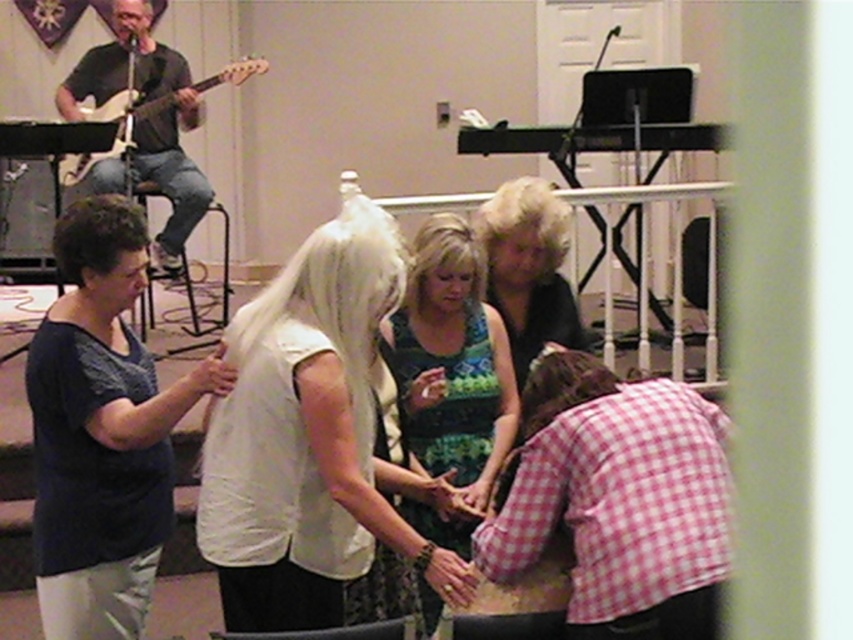
You are a photographer at the event and need to capture a photo of the white matte veil at center and the dark blue fabric shirt at left. Based on their heights, which object should you adjust your camera angle to focus on first?

The white matte veil at center is not as tall as the dark blue fabric shirt at left, so you should focus on the dark blue fabric shirt at left first since it is taller and might be more prominent in the frame.

You are a photographer at a wedding event. You want to capture a photo of the white matte veil at center and the dark blue fabric shirt at left in the same frame. The camera you are using has a minimum focus distance of 30 centimeters. Can you take the photo without moving either object?

The white matte veil at center and dark blue fabric shirt at left are 34.38 centimeters apart from each other. Since the minimum focus distance is 30 centimeters, the camera can focus on both objects as their separation meets the required distance. Therefore, you can take the photo without moving either object.

You are a photographer at a wedding event. You need to capture a closeup shot of the white matte veil at center and the black silky dress at center. Since the veil might block the dress in the photo, can you determine which one is bigger so you know which to focus on first?

The white matte veil at center is larger in size than the black silky dress at center, so you should focus on the veil first to ensure it is fully captured in the photo.